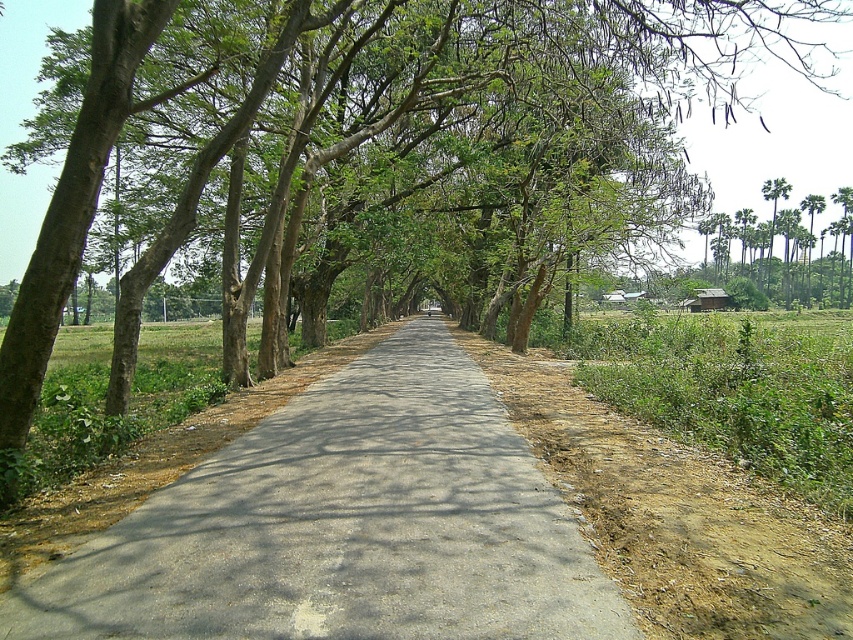
This screenshot has width=853, height=640. I want to click on gray concrete road at center, so click(344, 525).

Image resolution: width=853 pixels, height=640 pixels. Identify the location of gray concrete road at center. (344, 525).

Locate an element on the screen. The image size is (853, 640). gray concrete road at center is located at coordinates click(x=344, y=525).

Between gray concrete road at center and brown dirt track at right, which one appears on the left side from the viewer's perspective?

gray concrete road at center

Between gray concrete road at center and brown dirt track at right, which one is positioned higher?

Positioned higher is brown dirt track at right.

Between point (407, 353) and point (630, 529), which one is positioned behind?

The point (407, 353) is more distant.

The height and width of the screenshot is (640, 853). In order to click on gray concrete road at center in this screenshot , I will do `click(344, 525)`.

Which is more to the left, brown dirt track at right or green leafy palm trees at right?

From the viewer's perspective, brown dirt track at right appears more on the left side.

Looking at this image, is brown dirt track at right thinner than green leafy palm trees at right?

Yes.

Does point (834, 518) lie behind point (809, 280)?

No, (834, 518) is in front of (809, 280).

You are a GUI agent. You are given a task and a screenshot of the screen. Output one action in this format:
    pyautogui.click(x=<x>, y=<y>)
    Task: Click on the brown dirt track at right
    The height and width of the screenshot is (640, 853).
    Given the screenshot: What is the action you would take?
    pyautogui.click(x=675, y=515)